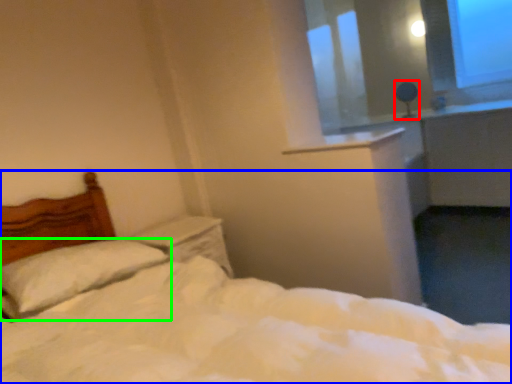
Question: Based on their relative distances, which object is farther from table lamp (highlighted by a red box)? Choose from bed (highlighted by a blue box) and pillow (highlighted by a green box).

Choices:
 (A) bed
 (B) pillow

Answer: (A)